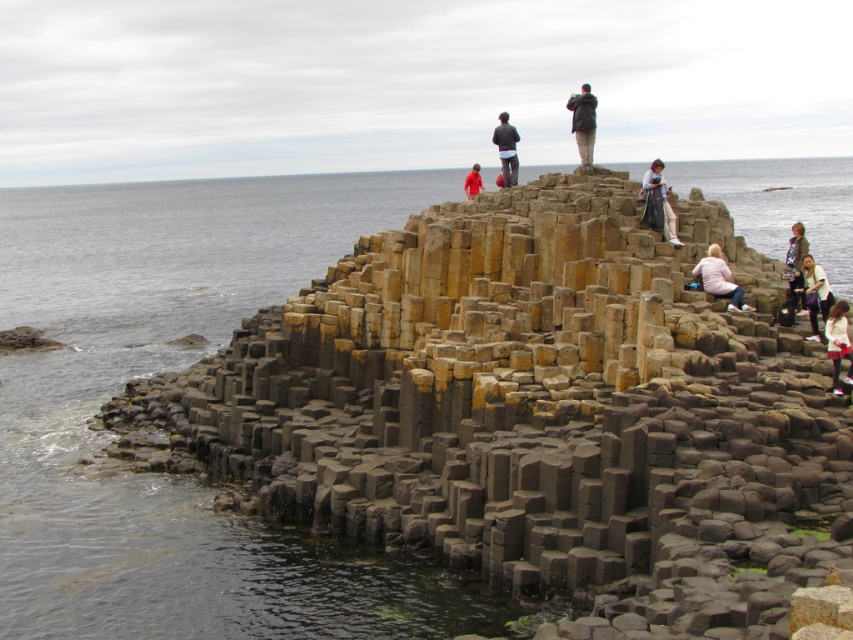
You are a photographer planning to take a photo of the Giant Causeway. You notice two jackets left by visitors on the hexagonal basalt columns. The jackets are the matte gray jacket at upper center and the red fabric jacket at center. Based on their positions, which jacket is closer to the edge of the basalt columns leading towards the sea?

The red fabric jacket at center is closer to the edge of the basalt columns leading towards the sea since it has a greater height compared to the matte gray jacket at upper center.

You are standing at the Giant Causeway and see two points marked on the image. The first point is at coordinate point (152, 378) and the second point is at coordinate point (845, 376). Which point is closer to you?

Point (845, 376) is closer to you because it is in front of point (152, 378).